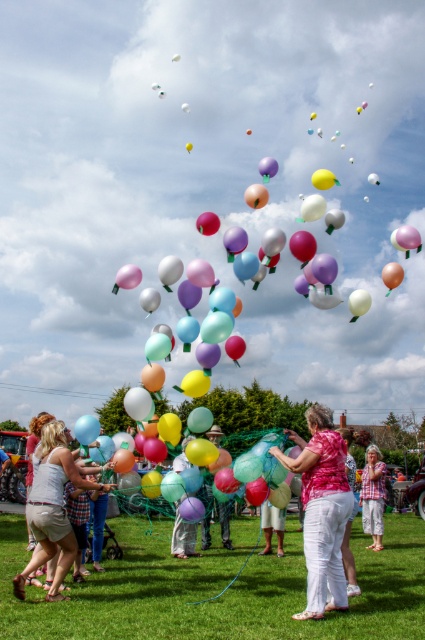
Who is taller, matte white shorts at lower left or pink cotton shirt at center?

Standing taller between the two is matte white shorts at lower left.

Describe the element at coordinates (53, 506) in the screenshot. I see `matte white shorts at lower left` at that location.

Does point (50, 506) come in front of point (382, 508)?

Yes, point (50, 506) is closer to viewer.

Locate an element on the screen. The width and height of the screenshot is (425, 640). matte white shorts at lower left is located at coordinates (53, 506).

Can you confirm if pink fabric at center is positioned to the right of pink cotton shirt at center?

Incorrect, pink fabric at center is not on the right side of pink cotton shirt at center.

Can you confirm if pink fabric at center is shorter than pink cotton shirt at center?

No, pink fabric at center is not shorter than pink cotton shirt at center.

Who is more distant from viewer, (345, 520) or (377, 500)?

Positioned behind is point (377, 500).

The width and height of the screenshot is (425, 640). What are the coordinates of `pink fabric at center` in the screenshot? It's located at (322, 509).

Between translucent plastic balloons at center and pink fabric at center, which one appears on the left side from the viewer's perspective?

Positioned to the left is translucent plastic balloons at center.

Can you confirm if translucent plastic balloons at center is thinner than pink fabric at center?

No, translucent plastic balloons at center is not thinner than pink fabric at center.

Where is `translucent plastic balloons at center`? This screenshot has width=425, height=640. translucent plastic balloons at center is located at coordinates (218, 589).